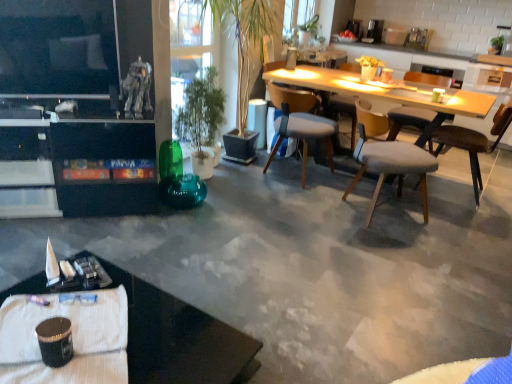
At what (x,y) coordinates should I click in order to perform the action: click on empty space that is to the right of metallic pen at lower left. Please return your answer as a coordinate pair (x, y). The height and width of the screenshot is (384, 512). Looking at the image, I should click on (80, 307).